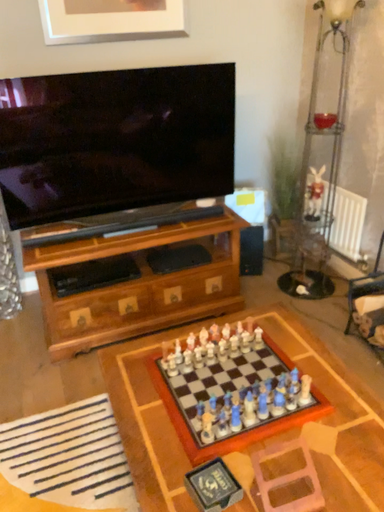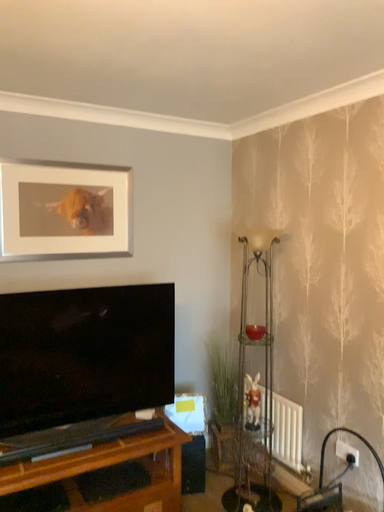
Question: How did the camera likely rotate when shooting the video?

Choices:
 (A) rotated upward
 (B) rotated downward

Answer: (A)